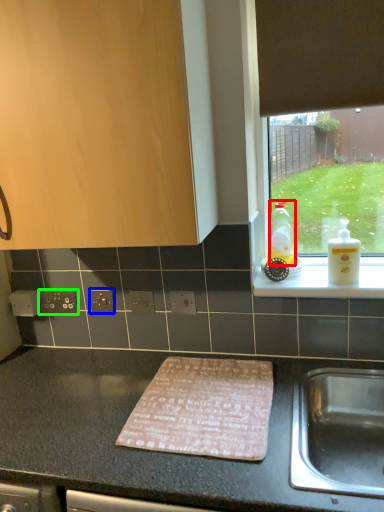
Question: Which is nearer to the bottle (highlighted by a red box)? electric outlet (highlighted by a blue box) or electric outlet (highlighted by a green box).

Choices:
 (A) electric outlet
 (B) electric outlet

Answer: (A)